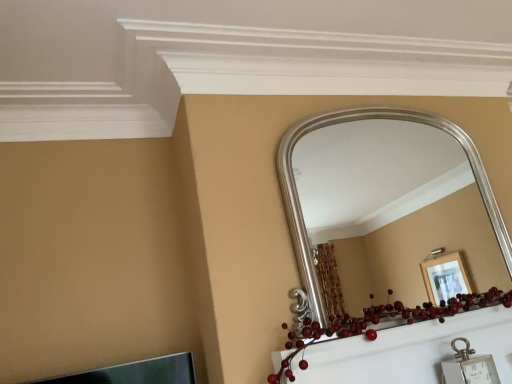
Identify the location of shiny red berries at center. Image resolution: width=512 pixels, height=384 pixels. (383, 330).

The width and height of the screenshot is (512, 384). Describe the element at coordinates (383, 330) in the screenshot. I see `shiny red berries at center` at that location.

Describe the element at coordinates (373, 175) in the screenshot. I see `silver metallic mirror at upper center` at that location.

Identify the location of silver metallic mirror at upper center. (373, 175).

The height and width of the screenshot is (384, 512). Identify the location of shiny red berries at center. (383, 330).

Considering the positions of objects shiny red berries at center and silver metallic mirror at upper center in the image provided, who is more to the left, shiny red berries at center or silver metallic mirror at upper center?

Positioned to the left is shiny red berries at center.

Who is more distant, shiny red berries at center or silver metallic mirror at upper center?

Positioned behind is silver metallic mirror at upper center.

Does point (376, 345) come in front of point (347, 226)?

Yes, point (376, 345) is in front of point (347, 226).

From the image's perspective, does shiny red berries at center appear lower than silver metallic mirror at upper center?

Yes, from the image's perspective, shiny red berries at center is beneath silver metallic mirror at upper center.

From a real-world perspective, who is located lower, shiny red berries at center or silver metallic mirror at upper center?

shiny red berries at center.

Can you confirm if shiny red berries at center is thinner than silver metallic mirror at upper center?

In fact, shiny red berries at center might be wider than silver metallic mirror at upper center.

Between shiny red berries at center and silver metallic mirror at upper center, which one has less height?

With less height is shiny red berries at center.

Is shiny red berries at center bigger than silver metallic mirror at upper center?

Correct, shiny red berries at center is larger in size than silver metallic mirror at upper center.

Is shiny red berries at center situated inside silver metallic mirror at upper center or outside?

shiny red berries at center cannot be found inside silver metallic mirror at upper center.

Would you consider shiny red berries at center to be distant from silver metallic mirror at upper center?

Indeed, shiny red berries at center is not near silver metallic mirror at upper center.

Is shiny red berries at center looking in the opposite direction of silver metallic mirror at upper center?

No, silver metallic mirror at upper center is not at the back of shiny red berries at center.

You are a GUI agent. You are given a task and a screenshot of the screen. Output one action in this format:
    pyautogui.click(x=<x>, y=<y>)
    Task: Click on the christmas decoration that appears in front of the silver metallic mirror at upper center
    The width and height of the screenshot is (512, 384).
    Given the screenshot: What is the action you would take?
    pyautogui.click(x=383, y=330)

In the scene shown: Can you confirm if silver metallic mirror at upper center is positioned to the left of shiny red berries at center?

Incorrect, silver metallic mirror at upper center is not on the left side of shiny red berries at center.

Is silver metallic mirror at upper center positioned behind shiny red berries at center?

That is True.

Considering the positions of point (424, 192) and point (350, 335), is point (424, 192) closer or farther from the camera than point (350, 335)?

Point (424, 192) appears to be farther away from the viewer than point (350, 335).

From the image's perspective, is silver metallic mirror at upper center above shiny red berries at center?

Yes, from the image's perspective, silver metallic mirror at upper center is over shiny red berries at center.

From a real-world perspective, which is physically below, silver metallic mirror at upper center or shiny red berries at center?

shiny red berries at center, from a real-world perspective.

Can you confirm if silver metallic mirror at upper center is thinner than shiny red berries at center?

Indeed, silver metallic mirror at upper center has a lesser width compared to shiny red berries at center.

Between silver metallic mirror at upper center and shiny red berries at center, which one has more height?

silver metallic mirror at upper center is taller.

Which of these two, silver metallic mirror at upper center or shiny red berries at center, is bigger?

shiny red berries at center is bigger.

Is shiny red berries at center located within silver metallic mirror at upper center?

That's incorrect, shiny red berries at center is not inside silver metallic mirror at upper center.

Are silver metallic mirror at upper center and shiny red berries at center located far from each other?

silver metallic mirror at upper center is positioned a significant distance from shiny red berries at center.

Is silver metallic mirror at upper center facing towards shiny red berries at center?

No, silver metallic mirror at upper center is not turned towards shiny red berries at center.

How many degrees apart are the facing directions of silver metallic mirror at upper center and shiny red berries at center?

The angle between the facing direction of silver metallic mirror at upper center and the facing direction of shiny red berries at center is 0.265 degrees.

Where is `mirror above the shiny red berries at center (from the image's perspective)`? mirror above the shiny red berries at center (from the image's perspective) is located at coordinates (373, 175).

Where is `christmas decoration below the silver metallic mirror at upper center (from a real-world perspective)`? christmas decoration below the silver metallic mirror at upper center (from a real-world perspective) is located at coordinates (383, 330).

The image size is (512, 384). I want to click on christmas decoration that appears in front of the silver metallic mirror at upper center, so click(x=383, y=330).